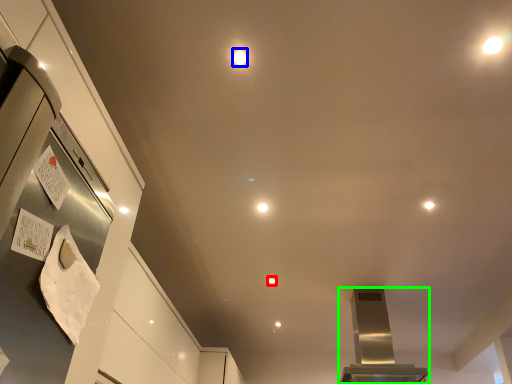
Question: Which is farther away from light (highlighted by a red box)? light (highlighted by a blue box) or home appliance (highlighted by a green box)?

Choices:
 (A) light
 (B) home appliance

Answer: (A)